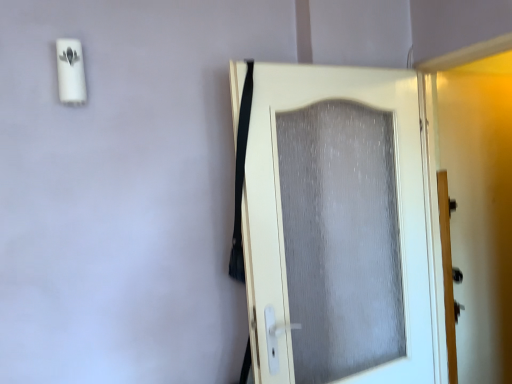
Question: From the image's perspective, is matte gray screen door at right positioned above or below white textured door at center?

Choices:
 (A) below
 (B) above

Answer: (B)

Question: Considering the positions of point (499, 362) and point (289, 104), is point (499, 362) closer or farther from the camera than point (289, 104)?

Choices:
 (A) farther
 (B) closer

Answer: (A)

Question: Is matte gray screen door at right taller or shorter than white textured door at center?

Choices:
 (A) short
 (B) tall

Answer: (B)

Question: In the image, is white textured door at center on the left side or the right side of matte gray screen door at right?

Choices:
 (A) right
 (B) left

Answer: (B)

Question: From a real-world perspective, is white textured door at center above or below matte gray screen door at right?

Choices:
 (A) below
 (B) above

Answer: (A)

Question: Is white textured door at center inside or outside of matte gray screen door at right?

Choices:
 (A) outside
 (B) inside

Answer: (A)

Question: Does point (352, 185) appear closer or farther from the camera than point (462, 119)?

Choices:
 (A) farther
 (B) closer

Answer: (B)